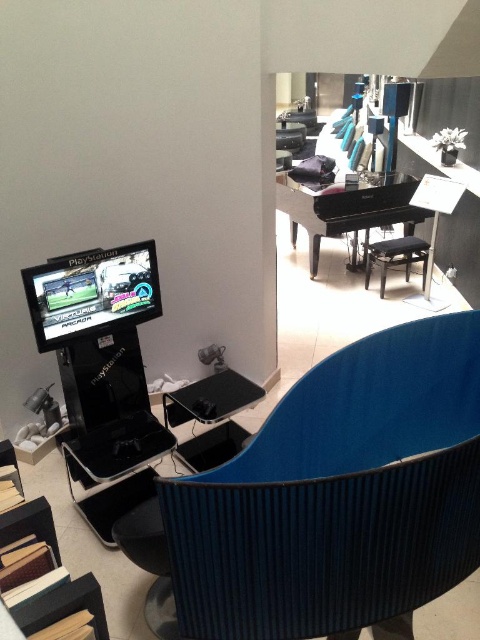
Describe the element at coordinates (338, 493) in the screenshot. I see `blue fabric swivel chair at lower right` at that location.

Is blue fabric swivel chair at lower right thinner than black leather stool at center?

In fact, blue fabric swivel chair at lower right might be wider than black leather stool at center.

Image resolution: width=480 pixels, height=640 pixels. Identify the location of blue fabric swivel chair at lower right. (338, 493).

Is point (36, 276) closer to viewer compared to point (372, 262)?

Yes, point (36, 276) is closer to viewer.

Does shiny black arcade machine at left appear on the right side of black leather stool at center?

Incorrect, shiny black arcade machine at left is not on the right side of black leather stool at center.

Does point (115, 316) come closer to viewer compared to point (418, 248)?

Yes, it is.

This screenshot has height=640, width=480. Find the location of `shiny black arcade machine at left`. shiny black arcade machine at left is located at coordinates (92, 292).

Is blue fabric swivel chair at lower right closer to camera compared to shiny black arcade machine at left?

Yes.

Between blue fabric swivel chair at lower right and shiny black arcade machine at left, which one has less height?

shiny black arcade machine at left is shorter.

Locate an element on the screen. This screenshot has width=480, height=640. blue fabric swivel chair at lower right is located at coordinates (338, 493).